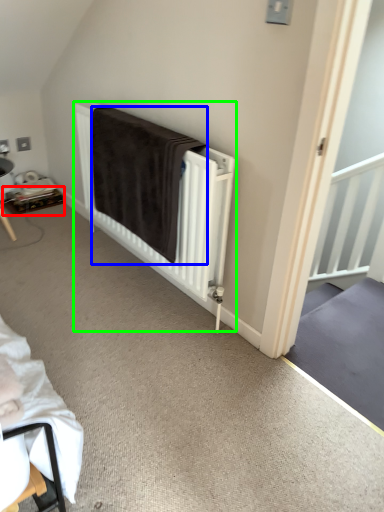
Question: Which object is positioned farthest from table (highlighted by a red box)? Select from blanket (highlighted by a blue box) and bed (highlighted by a green box).

Choices:
 (A) blanket
 (B) bed

Answer: (B)